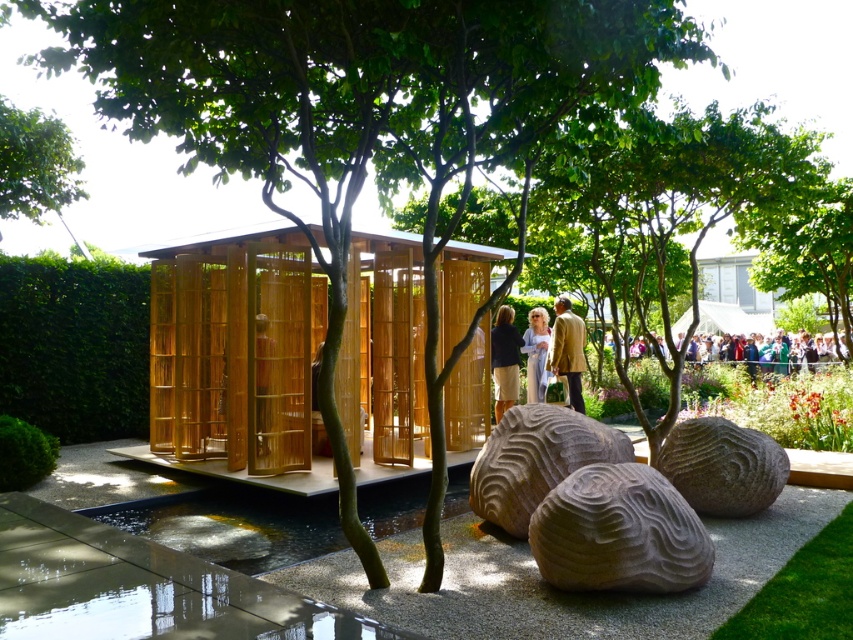
You are planning to install a solar panel on the tallest structure in the scene. Which object should you choose between the natural wood hut at center and the green leafy tree at upper left?

The natural wood hut at center is taller than the green leafy tree at upper left, so you should install the solar panel on the natural wood hut at center.

You are a photographer planning to take a portrait of the light blue fabric dress at center and the natural wood hut at center. To ensure both subjects are in frame, should you position yourself to the left or right of the dress?

You should position yourself to the right of the light blue fabric dress at center because the natural wood hut at center is on the left side of the dress, so placing yourself to the right will allow both subjects to be captured in the frame.

You are standing at the pavilion and looking at two points in the image. Which point, point [283,348] or point [527,376], is closer to you?

Point [283,348] is closer to the camera than point [527,376].